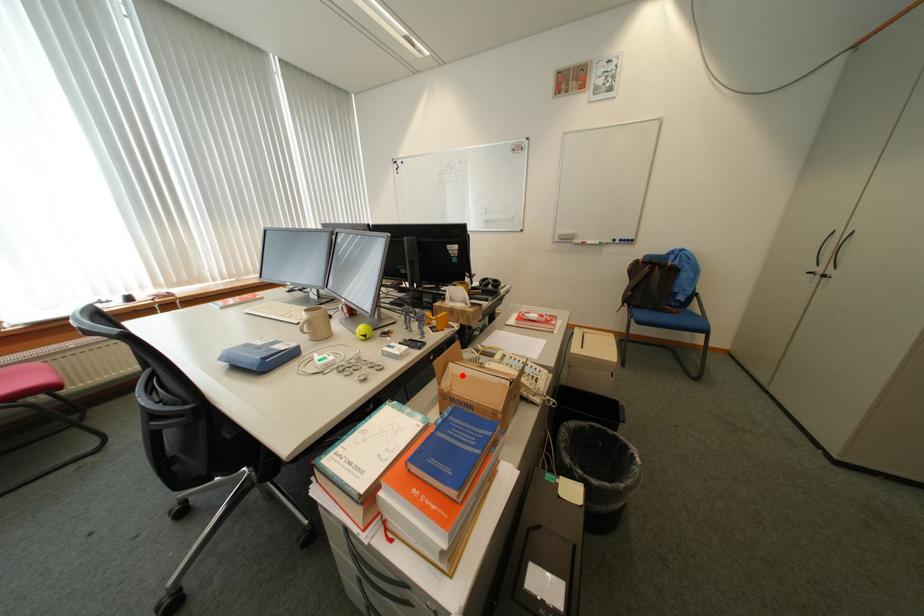
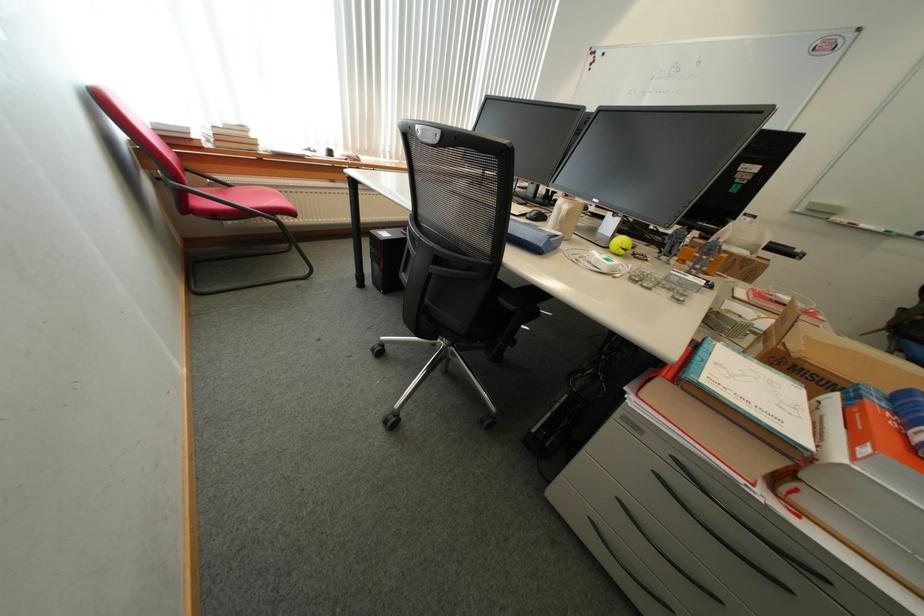
Question: I am providing you with two images of the same scene from different viewpoints. Image1 has a red point marked. In image2, the corresponding 3D location appears at what relative position? Reply with the corresponding letter.

Choices:
 (A) Closer
 (B) Farther

Answer: (A)